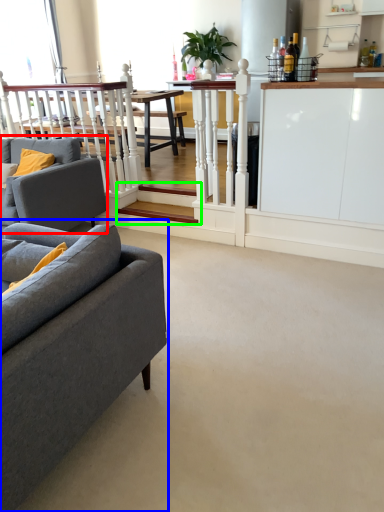
Question: Considering the real-world distances, which object is closest to studio couch (highlighted by a red box)? studio couch (highlighted by a blue box) or stairwell (highlighted by a green box).

Choices:
 (A) studio couch
 (B) stairwell

Answer: (B)